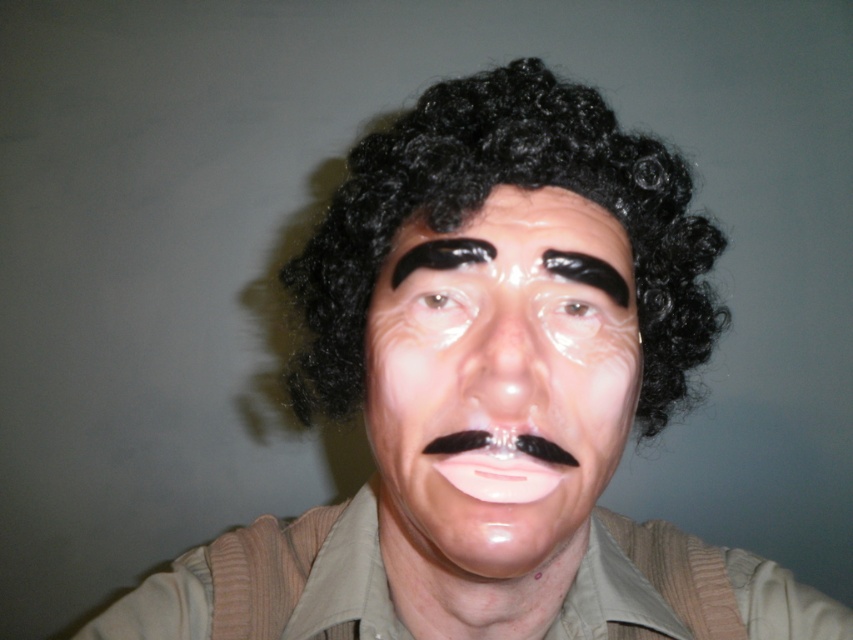
Is point (509, 333) farther from camera compared to point (451, 292)?

No, it is not.

Between point (515, 348) and point (428, 291), which one is positioned behind?

The point (428, 291) is more distant.

The image size is (853, 640). I want to click on translucent plastic nose at center, so click(503, 362).

Locate an element on the screen. translucent plastic nose at center is located at coordinates (503, 362).

Can you confirm if translucent plastic nose at center is shorter than translucent plastic eye at center?

Incorrect, translucent plastic nose at center's height does not fall short of translucent plastic eye at center's.

Consider the image. Can you confirm if translucent plastic nose at center is taller than translucent plastic eye at center?

Yes.

Which is behind, point (525, 308) or point (576, 314)?

The point (576, 314) is behind.

Where is `translucent plastic nose at center`? translucent plastic nose at center is located at coordinates 503,362.

Which is more to the right, glossy plastic face at center or black matte eyebrow at center?

glossy plastic face at center

Between glossy plastic face at center and black matte eyebrow at center, which one has less height?

Standing shorter between the two is black matte eyebrow at center.

Where is `glossy plastic face at center`? This screenshot has height=640, width=853. glossy plastic face at center is located at coordinates (500, 388).